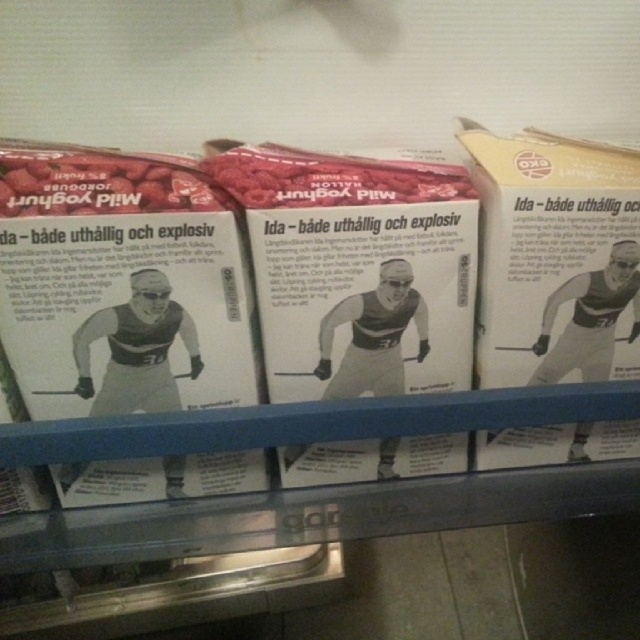
Based on the photo, can you confirm if white paperboard box at right is positioned to the right of raspberry matte at center?

Correct, you'll find white paperboard box at right to the right of raspberry matte at center.

Which is behind, point (540, 305) or point (460, 170)?

Point (460, 170)

Is point (532, 353) closer to viewer compared to point (348, 164)?

No.

Locate an element on the screen. white paperboard box at right is located at coordinates (556, 260).

Is raspberry matte at center thinner than matte white yogurt at left?

No.

Is point (337, 198) positioned before point (168, 209)?

That is False.

The height and width of the screenshot is (640, 640). I want to click on raspberry matte at center, so click(330, 179).

This screenshot has width=640, height=640. What do you see at coordinates (556, 260) in the screenshot? I see `white paperboard box at right` at bounding box center [556, 260].

Does white paperboard box at right have a greater width compared to matte white yogurt at left?

No.

Is point (509, 141) closer to camera compared to point (51, 193)?

That is False.

At what (x,y) coordinates should I click in order to perform the action: click on white paperboard box at right. Please return your answer as a coordinate pair (x, y). Looking at the image, I should click on (556, 260).